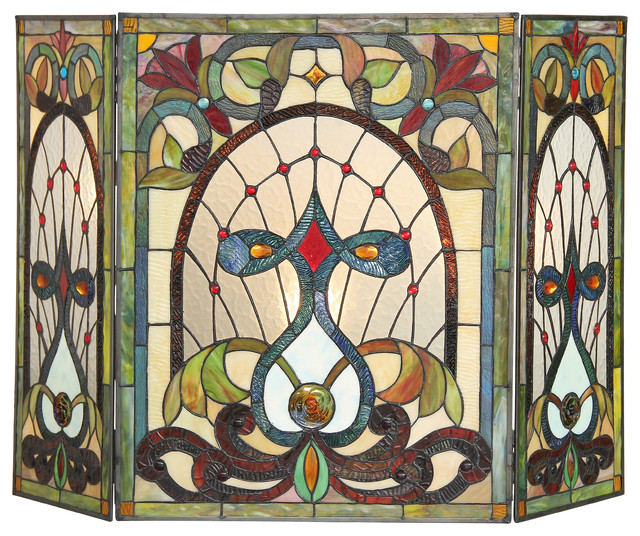
At what (x,y) coordinates should I click in order to perform the action: click on decorative design. Please return your answer as a coordinate pair (x, y). Image resolution: width=640 pixels, height=536 pixels. Looking at the image, I should click on (312, 410).